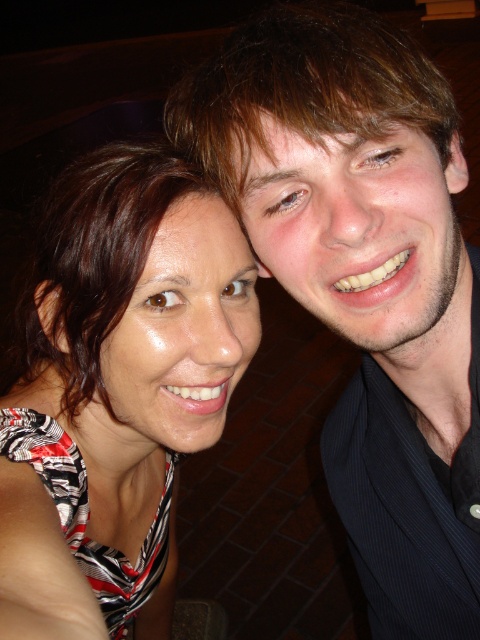
Question: Which point is farther to the camera?

Choices:
 (A) black pinstripe suit at right
 (B) matte black dress at left

Answer: (A)

Question: Can you confirm if black pinstripe suit at right is thinner than matte black dress at left?

Choices:
 (A) yes
 (B) no

Answer: (B)

Question: Can you confirm if black pinstripe suit at right is positioned above matte black dress at left?

Choices:
 (A) yes
 (B) no

Answer: (A)

Question: Which object appears closest to the camera in this image?

Choices:
 (A) matte black dress at left
 (B) black pinstripe suit at right

Answer: (A)

Question: Which point is farther to the camera?

Choices:
 (A) matte black dress at left
 (B) black pinstripe suit at right

Answer: (B)

Question: Is black pinstripe suit at right bigger than matte black dress at left?

Choices:
 (A) no
 (B) yes

Answer: (A)